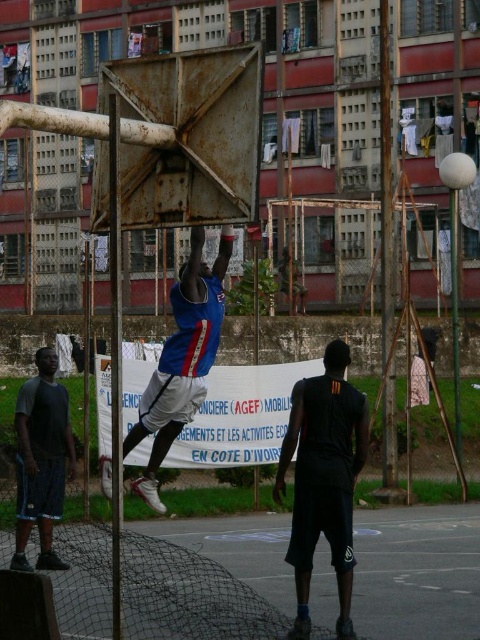
You are a photographer positioned at the center of the basketball court. You want to take a photo of both the black matte shorts at lower right and the dark gray fabric shorts at lower left. Which direction should you move to ensure both are in frame?

You should move to the left to ensure both the black matte shorts at lower right and the dark gray fabric shorts at lower left are in frame, as the black matte shorts at lower right is to the right of dark gray fabric shorts at lower left.

You are standing at the center of the basketball court and want to locate the blue jersey at center. According to the coordinates provided, in which direction should you look to find it?

The blue jersey at center is located at coordinates point (x=181, y=358), so you should look slightly to the right and downward from the center point to find it.

You are standing at the center of the basketball court. Looking towards the lower right corner, can you see the black matte shorts at lower right? If yes, what are their coordinates?

Yes, the black matte shorts at lower right are located at coordinates point (x=324, y=480).